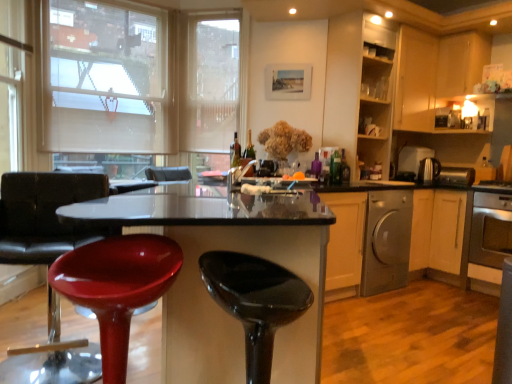
Question: Should I look upward or downward to see glossy plastic stool at center, acting as the first chair starting from the back?

Choices:
 (A) up
 (B) down

Answer: (B)

Question: From a real-world perspective, is glossy plastic stool at center, which is the 1th chair in left-to-right order, positioned over glossy plastic table at center based on gravity?

Choices:
 (A) yes
 (B) no

Answer: (A)

Question: Is glossy plastic stool at center, acting as the 2th chair starting from the front, oriented away from glossy plastic table at center?

Choices:
 (A) no
 (B) yes

Answer: (A)

Question: Considering the relative positions of glossy plastic stool at center, which is the 1th chair in left-to-right order, and glossy plastic table at center in the image provided, is glossy plastic stool at center, which is the 1th chair in left-to-right order, to the left of glossy plastic table at center from the viewer's perspective?

Choices:
 (A) yes
 (B) no

Answer: (A)

Question: Is the position of glossy plastic stool at center, which is the 1th chair in left-to-right order, less distant than that of glossy plastic table at center?

Choices:
 (A) yes
 (B) no

Answer: (B)

Question: Is glossy plastic stool at center, which is the 1th chair in left-to-right order, not inside glossy plastic table at center?

Choices:
 (A) no
 (B) yes

Answer: (B)

Question: Can you confirm if glossy plastic stool at center, the 2th chair from the right, is wider than glossy plastic table at center?

Choices:
 (A) no
 (B) yes

Answer: (A)

Question: Considering the relative positions of beige fabric window screen at upper left, which is the second window screen in right-to-left order, and silver metallic dishwasher at lower right in the image provided, is beige fabric window screen at upper left, which is the second window screen in right-to-left order, to the left of silver metallic dishwasher at lower right from the viewer's perspective?

Choices:
 (A) no
 (B) yes

Answer: (B)

Question: Can you confirm if beige fabric window screen at upper left, which appears as the 1th window screen when viewed from the left, is taller than silver metallic dishwasher at lower right?

Choices:
 (A) no
 (B) yes

Answer: (B)

Question: Is beige fabric window screen at upper left, which is the second window screen in right-to-left order, wider than silver metallic dishwasher at lower right?

Choices:
 (A) no
 (B) yes

Answer: (A)

Question: From the image's perspective, is beige fabric window screen at upper left, which is the second window screen in right-to-left order, over silver metallic dishwasher at lower right?

Choices:
 (A) no
 (B) yes

Answer: (B)

Question: Is beige fabric window screen at upper left, which appears as the 1th window screen when viewed from the left, placed right next to silver metallic dishwasher at lower right?

Choices:
 (A) yes
 (B) no

Answer: (B)

Question: Is beige fabric window screen at upper left, which is the second window screen in right-to-left order, smaller than silver metallic dishwasher at lower right?

Choices:
 (A) yes
 (B) no

Answer: (B)

Question: Considering the relative sizes of translucent glass bottle at center, which is the second bottle in right-to-left order, and green glass bottle at center, which is the first bottle in left-to-right order, in the image provided, is translucent glass bottle at center, which is the second bottle in right-to-left order, bigger than green glass bottle at center, which is the first bottle in left-to-right order,?

Choices:
 (A) no
 (B) yes

Answer: (B)